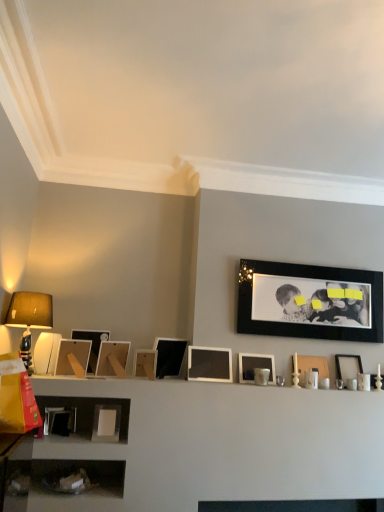
Question: Considering the positions of matte black picture frame at center, which is counted as the 6th picture frame, starting from the right, and white matte picture frame at center, the seventh picture frame from the left, in the image, is matte black picture frame at center, which is counted as the 6th picture frame, starting from the right, wider or thinner than white matte picture frame at center, the seventh picture frame from the left,?

Choices:
 (A) thin
 (B) wide

Answer: (B)

Question: Is matte black picture frame at center, which is counted as the 6th picture frame, starting from the right, situated inside white matte picture frame at center, the 5th picture frame viewed from the right, or outside?

Choices:
 (A) inside
 (B) outside

Answer: (B)

Question: Considering the real-world distances, which object is closest to the matte wooden picture frame at center, positioned as the 8th picture frame in right-to-left order?

Choices:
 (A) white glossy picture frame at right, the 1th picture frame when ordered from right to left
 (B) white matte picture frame at lower left, positioned as the ninth picture frame in right-to-left order
 (C) matte black picture frame at center, which is counted as the sixth picture frame, starting from the left
 (D) matte black lampshade at left
 (E) black matte picture frame at upper right, which ranks as the second picture frame in right-to-left order

Answer: (C)

Question: Based on their relative distances, which object is nearer to the white matte picture frame at center, the seventh picture frame from the left?

Choices:
 (A) matte wooden picture frame at center, the 4th picture frame from the left
 (B) matte black lampshade at left
 (C) white matte picture frame at lower left, the third picture frame viewed from the left
 (D) matte black picture frame at center, which is counted as the sixth picture frame, starting from the left
 (E) black matte picture frame at upper right, which is counted as the tenth picture frame, starting from the left

Answer: (D)